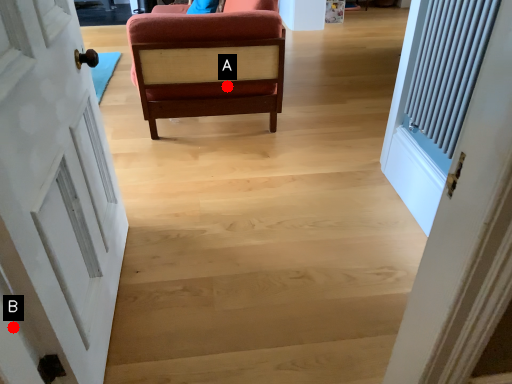
Question: Two points are circled on the image, labeled by A and B beside each circle. Which point is farther to the camera?

Choices:
 (A) A is further
 (B) B is further

Answer: (A)